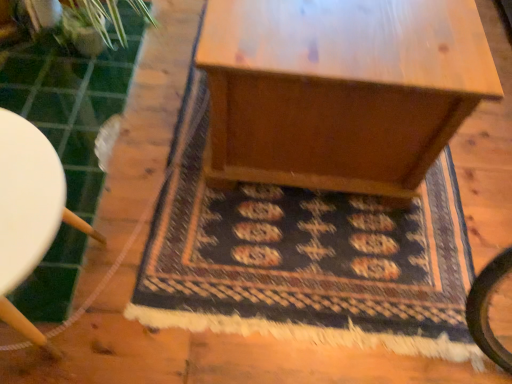
This screenshot has width=512, height=384. Describe the element at coordinates (29, 212) in the screenshot. I see `white plastic stool at left` at that location.

This screenshot has width=512, height=384. What are the coordinates of `dark blue woven rug at center` in the screenshot? It's located at click(x=309, y=263).

Locate an element on the screen. This screenshot has height=384, width=512. white plastic stool at left is located at coordinates (29, 212).

Does point (212, 57) lie behind point (16, 209)?

That is True.

Is wooden table at center positioned before white plastic stool at left?

No, it is behind white plastic stool at left.

From a real-world perspective, is wooden table at center positioned under white plastic stool at left based on gravity?

No, from a real-world perspective, wooden table at center is not under white plastic stool at left.

Is wooden table at center a part of white plastic stool at left?

No.

Is white plastic stool at left facing towards wooden table at center?

No, white plastic stool at left does not turn towards wooden table at center.

Consider the image. Is white plastic stool at left to the right of wooden table at center from the viewer's perspective?

Incorrect, white plastic stool at left is not on the right side of wooden table at center.

Is white plastic stool at left located outside dark blue woven rug at center?

Yes, white plastic stool at left is located beyond the bounds of dark blue woven rug at center.

Is white plastic stool at left oriented towards dark blue woven rug at center?

No.

From a real-world perspective, is white plastic stool at left positioned above or below dark blue woven rug at center?

Clearly, from a real-world perspective, white plastic stool at left is above dark blue woven rug at center.

Can you confirm if white plastic stool at left is smaller than dark blue woven rug at center?

Actually, white plastic stool at left might be larger than dark blue woven rug at center.

Considering the sizes of objects wooden table at center and dark blue woven rug at center in the image provided, who is wider, wooden table at center or dark blue woven rug at center?

With larger width is dark blue woven rug at center.

Is wooden table at center touching dark blue woven rug at center?

No, wooden table at center is not next to dark blue woven rug at center.

In the scene shown: Is wooden table at center behind dark blue woven rug at center?

No, it is in front of dark blue woven rug at center.

Measure the distance between wooden table at center and dark blue woven rug at center.

wooden table at center is 31.23 centimeters away from dark blue woven rug at center.

Is dark blue woven rug at center looking in the opposite direction of wooden table at center?

Yes, dark blue woven rug at center is facing away from wooden table at center.

Which of these two, dark blue woven rug at center or wooden table at center, is wider?

dark blue woven rug at center is wider.

Which is correct: dark blue woven rug at center is inside wooden table at center, or outside of it?

The correct answer is: outside.

Is dark blue woven rug at center positioned far away from white plastic stool at left?

No, there isn't a large distance between dark blue woven rug at center and white plastic stool at left.

Is dark blue woven rug at center at the left side of white plastic stool at left?

No, dark blue woven rug at center is not to the left of white plastic stool at left.

From a real-world perspective, who is located lower, dark blue woven rug at center or white plastic stool at left?

dark blue woven rug at center is physically lower.

This screenshot has height=384, width=512. I want to click on table above the white plastic stool at left (from the image's perspective), so [x=340, y=90].

I want to click on furniture that appears below the wooden table at center (from the image's perspective), so click(x=29, y=212).

From the image, which object appears to be nearer to wooden table at center, dark blue woven rug at center or white plastic stool at left?

The object closer to wooden table at center is dark blue woven rug at center.

Estimate the real-world distances between objects in this image. Which object is further from dark blue woven rug at center, white plastic stool at left or wooden table at center?

white plastic stool at left is further to dark blue woven rug at center.

Based on their spatial positions, is wooden table at center or dark blue woven rug at center closer to white plastic stool at left?

dark blue woven rug at center.

Looking at the image, which one is located closer to dark blue woven rug at center, wooden table at center or white plastic stool at left?

wooden table at center lies closer to dark blue woven rug at center than the other object.

Consider the image. When comparing their distances from white plastic stool at left, does dark blue woven rug at center or wooden table at center seem further?

wooden table at center is positioned further to the anchor white plastic stool at left.

Looking at the image, which one is located closer to wooden table at center, white plastic stool at left or dark blue woven rug at center?

dark blue woven rug at center is closer to wooden table at center.

The height and width of the screenshot is (384, 512). In order to click on mat between white plastic stool at left and wooden table at center in the horizontal direction in this screenshot , I will do `click(309, 263)`.